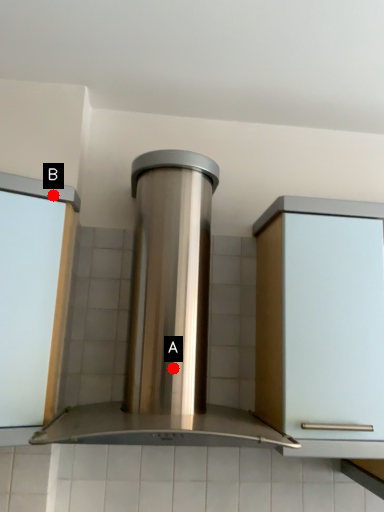
Question: Two points are circled on the image, labeled by A and B beside each circle. Which point is closer to the camera taking this photo?

Choices:
 (A) A is closer
 (B) B is closer

Answer: (A)